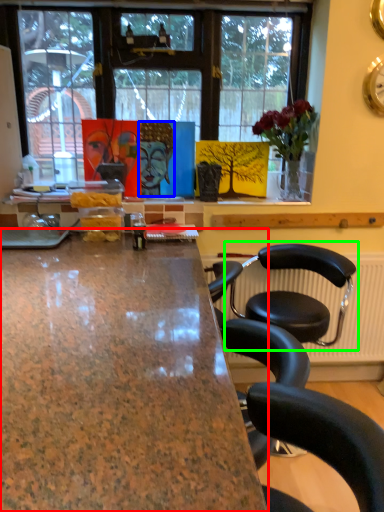
Question: Which object is positioned farthest from desk (highlighted by a red box)? Select from person (highlighted by a blue box) and chair (highlighted by a green box).

Choices:
 (A) person
 (B) chair

Answer: (A)